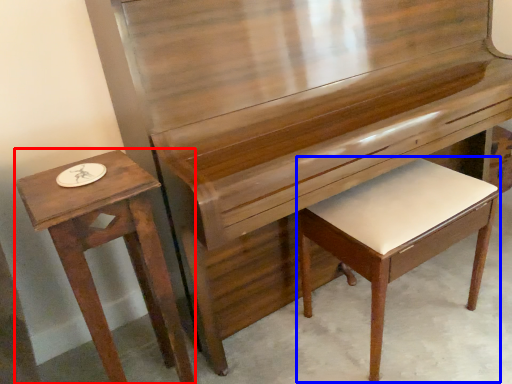
Question: Which object appears closest to the camera in this image, table (highlighted by a red box) or music stool (highlighted by a blue box)?

Choices:
 (A) table
 (B) music stool

Answer: (A)